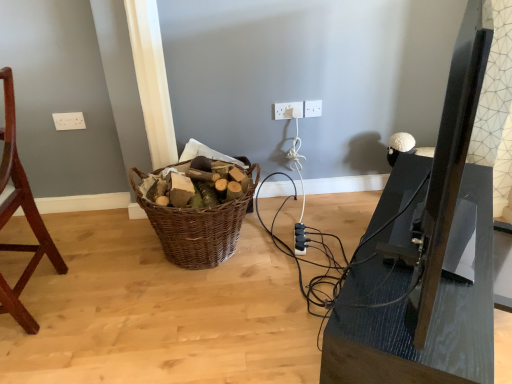
What are the coordinates of `empty space that is in between matte black tv stand at right and woven brown basket at center` in the screenshot? It's located at (279, 282).